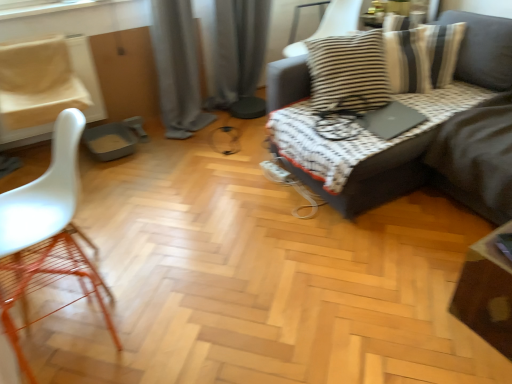
Locate an element on the screen. This screenshot has height=384, width=512. vacant area that lies between white matte chair at left, positioned as the third chair in back-to-front order, and wooden table at lower right is located at coordinates (282, 300).